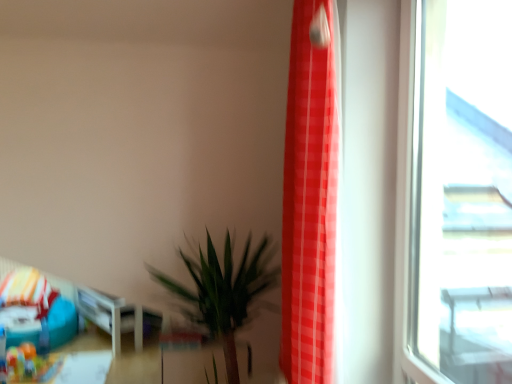
Question: From a real-world perspective, is teal fabric bean bag at lower left located higher than red checkered curtain at right?

Choices:
 (A) no
 (B) yes

Answer: (A)

Question: From a real-world perspective, is teal fabric bean bag at lower left under red checkered curtain at right?

Choices:
 (A) yes
 (B) no

Answer: (A)

Question: Does teal fabric bean bag at lower left have a larger size compared to red checkered curtain at right?

Choices:
 (A) no
 (B) yes

Answer: (B)

Question: Is teal fabric bean bag at lower left positioned with its back to red checkered curtain at right?

Choices:
 (A) yes
 (B) no

Answer: (B)

Question: From the image's perspective, would you say teal fabric bean bag at lower left is shown under red checkered curtain at right?

Choices:
 (A) no
 (B) yes

Answer: (B)

Question: Is teal fabric bean bag at lower left positioned behind red checkered curtain at right?

Choices:
 (A) no
 (B) yes

Answer: (B)

Question: Is red checkered curtain at right in contact with green leafy plant at lower center?

Choices:
 (A) no
 (B) yes

Answer: (A)

Question: Is red checkered curtain at right located outside green leafy plant at lower center?

Choices:
 (A) yes
 (B) no

Answer: (A)

Question: Does red checkered curtain at right have a lesser width compared to green leafy plant at lower center?

Choices:
 (A) yes
 (B) no

Answer: (A)

Question: From the image's perspective, is red checkered curtain at right on top of green leafy plant at lower center?

Choices:
 (A) yes
 (B) no

Answer: (A)

Question: From a real-world perspective, is red checkered curtain at right physically below green leafy plant at lower center?

Choices:
 (A) no
 (B) yes

Answer: (A)

Question: Considering the relative sizes of red checkered curtain at right and green leafy plant at lower center in the image provided, is red checkered curtain at right smaller than green leafy plant at lower center?

Choices:
 (A) yes
 (B) no

Answer: (A)

Question: From a real-world perspective, is green leafy plant at lower center beneath teal fabric bean bag at lower left?

Choices:
 (A) no
 (B) yes

Answer: (A)